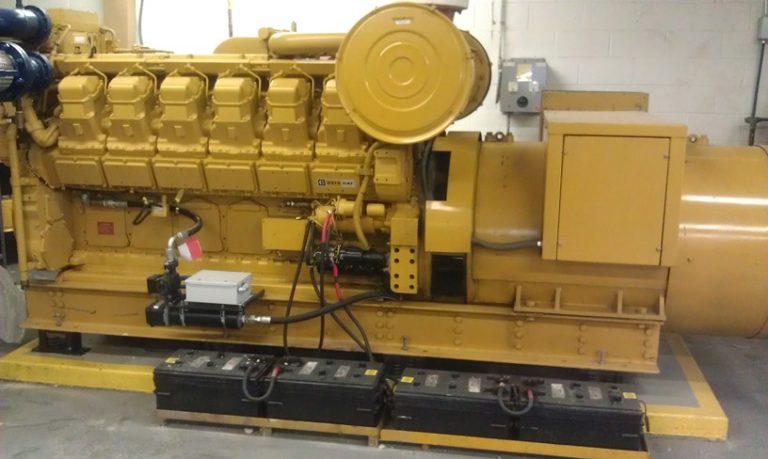
You are a GUI agent. You are given a task and a screenshot of the screen. Output one action in this format:
    pyautogui.click(x=<x>, y=<y>)
    Task: Click on the black wires
    Image resolution: width=768 pixels, height=459 pixels.
    Given the screenshot: What is the action you would take?
    pyautogui.click(x=348, y=316), pyautogui.click(x=333, y=311)